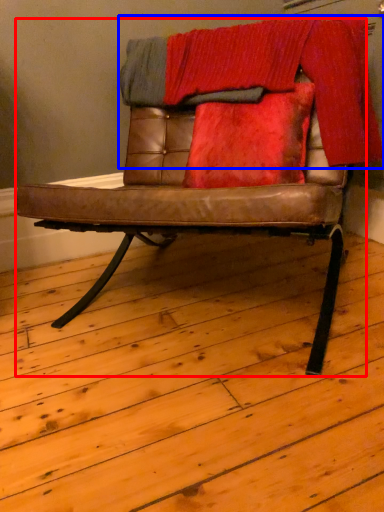
Question: Among these objects, which one is nearest to the camera, chair (highlighted by a red box) or blanket (highlighted by a blue box)?

Choices:
 (A) chair
 (B) blanket

Answer: (A)